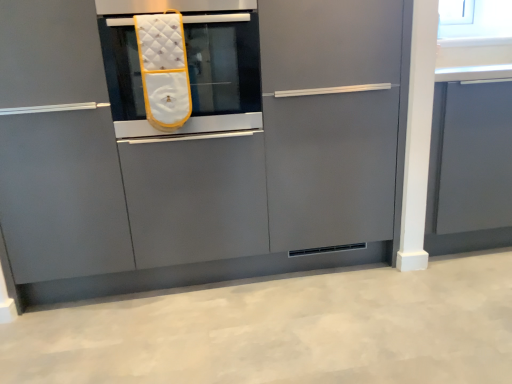
Question: From the image's perspective, is matte gray cabinet at right, marked as the first cabinetry in a right-to-left arrangement, above or below matte gray cabinet at center, which is the second cabinetry in right-to-left order?

Choices:
 (A) below
 (B) above

Answer: (A)

Question: Is matte gray cabinet at right, marked as the first cabinetry in a right-to-left arrangement, bigger or smaller than matte gray cabinet at center, which is the second cabinetry in right-to-left order?

Choices:
 (A) small
 (B) big

Answer: (A)

Question: Considering the real-world distances, which object is farthest from the matte gray cabinet at center, the first cabinetry from the left?

Choices:
 (A) white quilted oven mitt at center
 (B) matte gray cabinet at right, the 2th cabinetry positioned from the left

Answer: (B)

Question: Estimate the real-world distances between objects in this image. Which object is farther from the matte gray cabinet at center, the first cabinetry from the left?

Choices:
 (A) matte gray cabinet at right, the 2th cabinetry positioned from the left
 (B) white quilted oven mitt at center

Answer: (A)